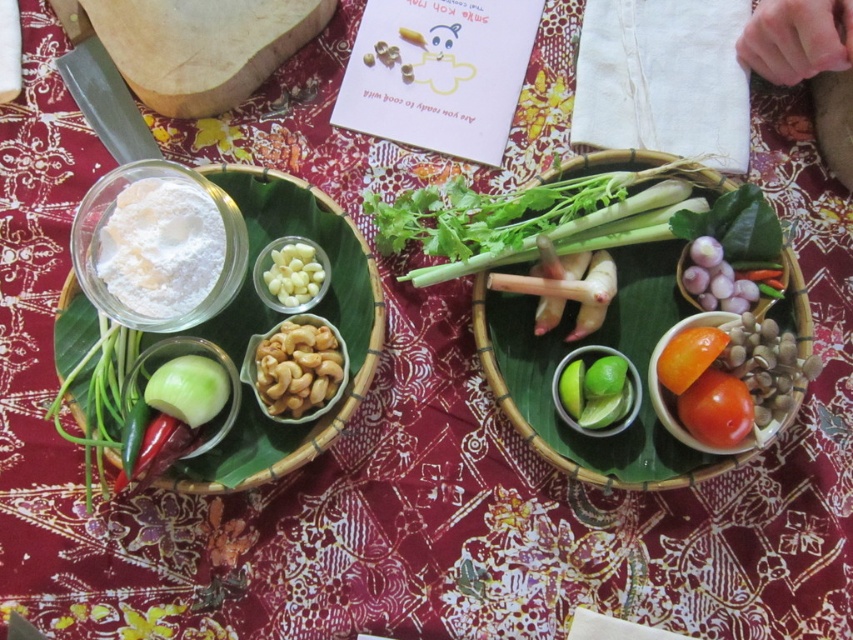
Question: Does green leafy vegetable at upper right have a smaller size compared to green matte lime at center?

Choices:
 (A) no
 (B) yes

Answer: (A)

Question: Which object is positioned farthest from the green leafy at center?

Choices:
 (A) green smooth onion at lower left
 (B) white cloth at upper right
 (C) purple translucent onion at right

Answer: (A)

Question: Does green leafy vegetable at upper right have a smaller size compared to green matte lime at center?

Choices:
 (A) no
 (B) yes

Answer: (A)

Question: Is green smooth onion at lower left smaller than purple translucent onion at right?

Choices:
 (A) yes
 (B) no

Answer: (B)

Question: Which of the following is the farthest from the observer?

Choices:
 (A) orange smooth tomato at center
 (B) red glossy tomato at right
 (C) green leafy vegetable at upper right

Answer: (C)

Question: Which object is the closest to the purple translucent onion at right?

Choices:
 (A) orange smooth tomato at center
 (B) green smooth onion at lower left

Answer: (A)